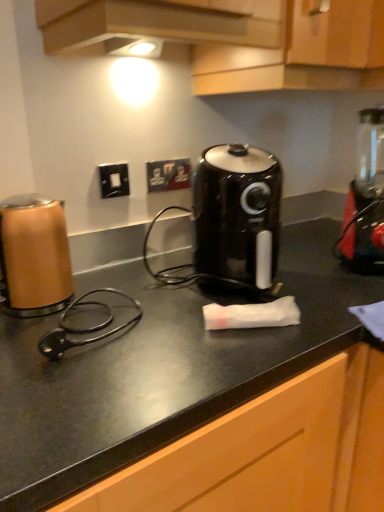
Locate an element on the screen. matte plastic electrical outlet at center, which is the 2th electric outlet from left to right is located at coordinates (168, 175).

This screenshot has width=384, height=512. I want to click on black plastic switch at center, marked as the first electric outlet in a front-to-back arrangement, so click(114, 180).

What do you see at coordinates (301, 52) in the screenshot? I see `wooden cabinet at upper center` at bounding box center [301, 52].

This screenshot has height=512, width=384. Describe the element at coordinates (184, 420) in the screenshot. I see `black matte countertop at center` at that location.

Locate an element on the screen. The height and width of the screenshot is (512, 384). black matte countertop at center is located at coordinates (184, 420).

The image size is (384, 512). I want to click on red plastic blender at right, so click(365, 198).

At what (x,y) coordinates should I click in order to perform the action: click on black plastic air fryer at center. Please return your answer as a coordinate pair (x, y). This screenshot has height=512, width=384. Looking at the image, I should click on (237, 215).

At what (x,y) coordinates should I click in order to perform the action: click on blender that appears behind the black matte countertop at center. Please return your answer as a coordinate pair (x, y). The height and width of the screenshot is (512, 384). Looking at the image, I should click on (365, 198).

From the image's perspective, who appears lower, red plastic blender at right or black matte countertop at center?

black matte countertop at center appears lower in the image.

Does red plastic blender at right turn towards black matte countertop at center?

No, red plastic blender at right is not turned towards black matte countertop at center.

Between matte plastic electrical outlet at center, the first electric outlet viewed from the right, and wooden cabinet at upper center, which one has larger size?

wooden cabinet at upper center is bigger.

Is point (158, 187) closer or farther from the camera than point (333, 15)?

Point (158, 187) appears to be farther away from the viewer than point (333, 15).

Is matte plastic electrical outlet at center, the first electric outlet viewed from the right, to the right of wooden cabinet at upper center from the viewer's perspective?

In fact, matte plastic electrical outlet at center, the first electric outlet viewed from the right, is to the left of wooden cabinet at upper center.

Is black plastic air fryer at center oriented towards copper metallic kettle at left?

No, black plastic air fryer at center is not facing towards copper metallic kettle at left.

Which of these two, black plastic air fryer at center or copper metallic kettle at left, stands taller?

Standing taller between the two is black plastic air fryer at center.

Who is bigger, black plastic air fryer at center or copper metallic kettle at left?

With larger size is black plastic air fryer at center.

Which object is thinner, black plastic air fryer at center or copper metallic kettle at left?

copper metallic kettle at left.

Looking at this image, considering their positions, is black plastic switch at center, which is the second electric outlet from back to front, located in front of or behind red plastic blender at right?

Clearly, black plastic switch at center, which is the second electric outlet from back to front, is behind red plastic blender at right.

Is red plastic blender at right inside black plastic switch at center, arranged as the second electric outlet when viewed from the right?

That's incorrect, red plastic blender at right is not inside black plastic switch at center, arranged as the second electric outlet when viewed from the right.

Is black plastic switch at center, marked as the 1th electric outlet in a left-to-right arrangement, oriented away from red plastic blender at right?

black plastic switch at center, marked as the 1th electric outlet in a left-to-right arrangement, does not have its back to red plastic blender at right.

Between black plastic switch at center, arranged as the second electric outlet when viewed from the right, and red plastic blender at right, which one has smaller width?

black plastic switch at center, arranged as the second electric outlet when viewed from the right.

Is black matte countertop at center inside the boundaries of wooden cabinet at upper center, or outside?

black matte countertop at center cannot be found inside wooden cabinet at upper center.

Looking at this image, from the image's perspective, is black matte countertop at center over wooden cabinet at upper center?

No, from the image's perspective, black matte countertop at center is not above wooden cabinet at upper center.

Is black matte countertop at center wider than wooden cabinet at upper center?

No.

Between copper metallic kettle at left and black plastic switch at center, arranged as the second electric outlet when viewed from the right, which one is positioned behind?

black plastic switch at center, arranged as the second electric outlet when viewed from the right, is more distant.

Does copper metallic kettle at left turn towards black plastic switch at center, arranged as the second electric outlet when viewed from the right?

No, copper metallic kettle at left is not facing towards black plastic switch at center, arranged as the second electric outlet when viewed from the right.

Based on their positions, is copper metallic kettle at left located to the left or right of black plastic switch at center, marked as the 1th electric outlet in a left-to-right arrangement?

copper metallic kettle at left is positioned on black plastic switch at center, marked as the 1th electric outlet in a left-to-right arrangement,'s left side.

Image resolution: width=384 pixels, height=512 pixels. Identify the location of electric outlet that is the 1st one below the wooden cabinet at upper center (from a real-world perspective). (114, 180).

Is wooden cabinet at upper center outside of black plastic switch at center, marked as the first electric outlet in a front-to-back arrangement?

Absolutely, wooden cabinet at upper center is external to black plastic switch at center, marked as the first electric outlet in a front-to-back arrangement.

Based on the photo, from a real-world perspective, which is physically above, wooden cabinet at upper center or black plastic switch at center, marked as the first electric outlet in a front-to-back arrangement?

From a 3D spatial view, wooden cabinet at upper center is above.

Does wooden cabinet at upper center have a lesser height compared to black plastic switch at center, arranged as the second electric outlet when viewed from the right?

No, wooden cabinet at upper center is not shorter than black plastic switch at center, arranged as the second electric outlet when viewed from the right.

Locate an element on the screen. blender located behind the black matte countertop at center is located at coordinates (365, 198).

From a real-world perspective, which electric outlet is the 2nd one underneath the wooden cabinet at upper center? Please provide its 2D coordinates.

[(168, 175)]

Based on their spatial positions, is red plastic blender at right or copper metallic kettle at left closer to black plastic air fryer at center?

red plastic blender at right.

When comparing their distances from black plastic switch at center, marked as the 1th electric outlet in a left-to-right arrangement, does wooden cabinet at upper center or matte plastic electrical outlet at center, which is the 2th electric outlet from left to right, seem closer?

matte plastic electrical outlet at center, which is the 2th electric outlet from left to right, is positioned closer to the anchor black plastic switch at center, marked as the 1th electric outlet in a left-to-right arrangement.

From the image, which object appears to be nearer to black plastic air fryer at center, copper metallic kettle at left or matte plastic electrical outlet at center, which is the 2th electric outlet from left to right?

matte plastic electrical outlet at center, which is the 2th electric outlet from left to right, lies closer to black plastic air fryer at center than the other object.

Estimate the real-world distances between objects in this image. Which object is further from black plastic air fryer at center, matte plastic electrical outlet at center, the first electric outlet viewed from the right, or black matte countertop at center?

matte plastic electrical outlet at center, the first electric outlet viewed from the right.

Considering their positions, is black matte countertop at center positioned closer to wooden cabinet at upper center than black plastic air fryer at center?

Based on the image, black plastic air fryer at center appears to be nearer to wooden cabinet at upper center.

Which object lies nearer to the anchor point copper metallic kettle at left, red plastic blender at right or black matte countertop at center?

The object closer to copper metallic kettle at left is black matte countertop at center.

When comparing their distances from red plastic blender at right, does matte plastic electrical outlet at center, which is the 2th electric outlet from left to right, or black plastic air fryer at center seem closer?

Among the two, black plastic air fryer at center is located nearer to red plastic blender at right.

Which object lies further to the anchor point matte plastic electrical outlet at center, which is the 2th electric outlet from left to right, black plastic switch at center, arranged as the second electric outlet when viewed from the right, or wooden cabinet at upper center?

The object further to matte plastic electrical outlet at center, which is the 2th electric outlet from left to right, is wooden cabinet at upper center.

Find the location of a particular element. cabinetry situated between black plastic switch at center, marked as the 1th electric outlet in a left-to-right arrangement, and red plastic blender at right from left to right is located at coordinates (301, 52).

The height and width of the screenshot is (512, 384). I want to click on blender between black plastic switch at center, which is the second electric outlet from back to front, and black matte countertop at center in the up-down direction, so click(365, 198).

Where is `cabinetry situated between matte plastic electrical outlet at center, positioned as the 2th electric outlet in front-to-back order, and red plastic blender at right from left to right`? This screenshot has height=512, width=384. cabinetry situated between matte plastic electrical outlet at center, positioned as the 2th electric outlet in front-to-back order, and red plastic blender at right from left to right is located at coordinates (301, 52).

Where is `kitchen appliance between copper metallic kettle at left and red plastic blender at right in the horizontal direction`? This screenshot has height=512, width=384. kitchen appliance between copper metallic kettle at left and red plastic blender at right in the horizontal direction is located at coordinates (237, 215).